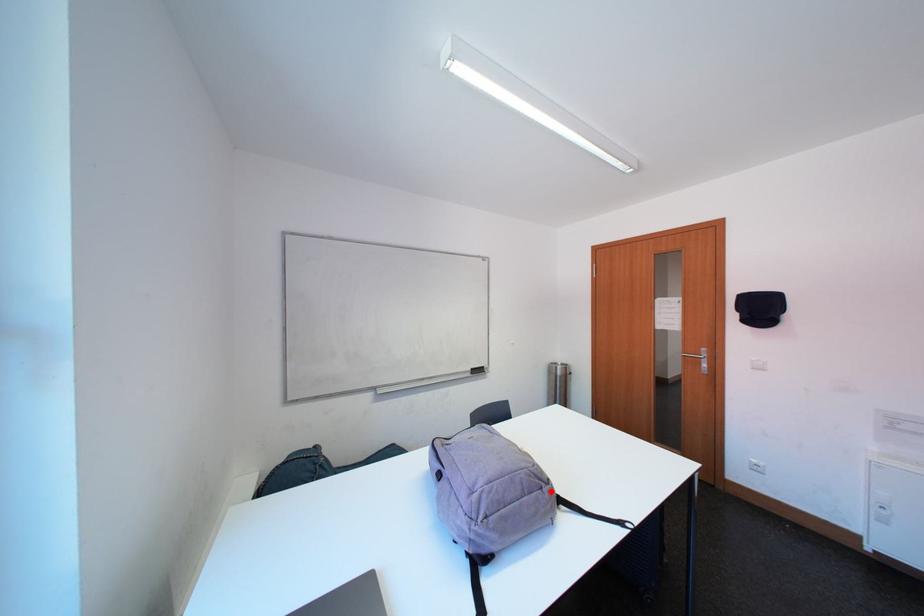
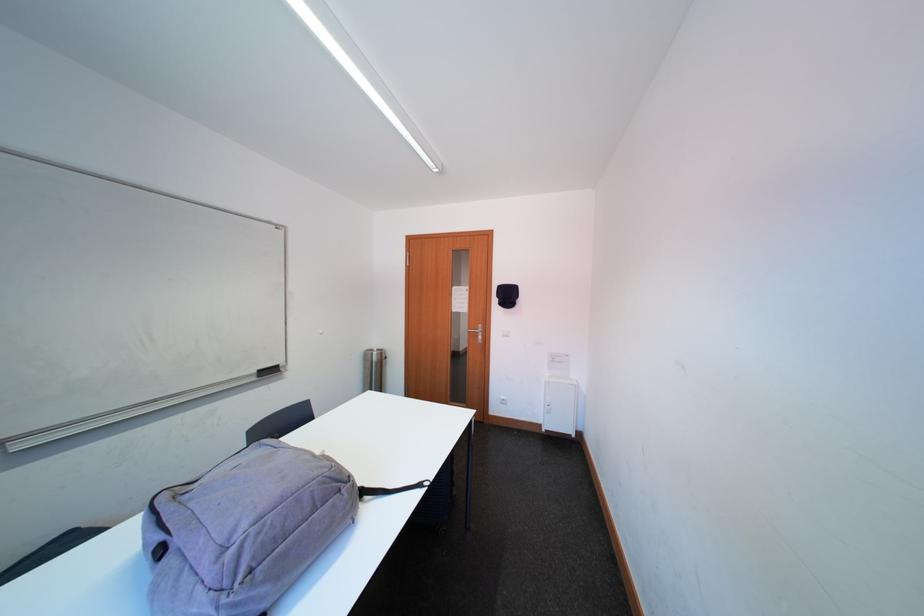
The point at the highlighted location is marked in the first image. Where is the corresponding point in the second image?

(349, 493)